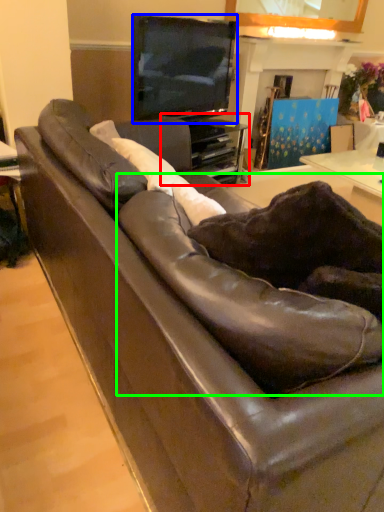
Question: Estimate the real-world distances between objects in this image. Which object is farther from entertainment center (highlighted by a red box), television (highlighted by a blue box) or swivel chair (highlighted by a green box)?

Choices:
 (A) television
 (B) swivel chair

Answer: (B)